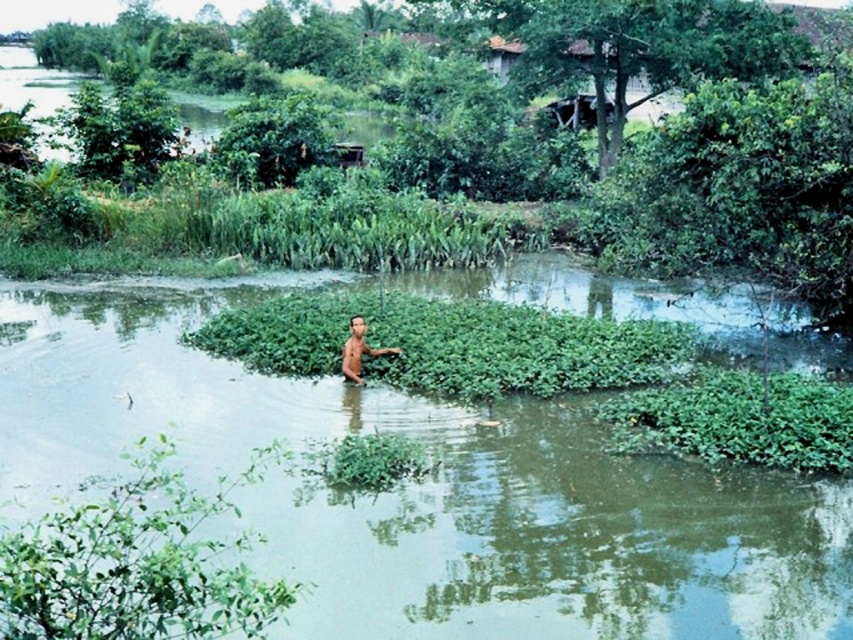
Does green leafy plant at lower left appear on the right side of brown skin man at center?

No, green leafy plant at lower left is not to the right of brown skin man at center.

Which is behind, point (231, 566) or point (364, 353)?

Point (364, 353)

What do you see at coordinates (138, 563) in the screenshot? The image size is (853, 640). I see `green leafy plant at lower left` at bounding box center [138, 563].

You are a GUI agent. You are given a task and a screenshot of the screen. Output one action in this format:
    pyautogui.click(x=<x>, y=<y>)
    Task: Click on the green leafy plant at lower left
    
    Given the screenshot: What is the action you would take?
    pyautogui.click(x=138, y=563)

Who is lower down, green leafy vegetation at center or brown skin man at center?

brown skin man at center is below.

Does green leafy vegetation at center have a larger size compared to brown skin man at center?

Correct, green leafy vegetation at center is larger in size than brown skin man at center.

Does point (38, 48) lie in front of point (347, 371)?

No, (38, 48) is further to viewer.

Where is `green leafy vegetation at center`? The height and width of the screenshot is (640, 853). green leafy vegetation at center is located at coordinates (212, 40).

Who is positioned more to the right, green leafy vegetation at center or green leafy plant at lower left?

Positioned to the right is green leafy plant at lower left.

Between green leafy vegetation at center and green leafy plant at lower left, which one is positioned lower?

Positioned lower is green leafy plant at lower left.

Does point (410, 10) come farther from viewer compared to point (242, 548)?

Yes, it is behind point (242, 548).

Where is `green leafy vegetation at center`? Image resolution: width=853 pixels, height=640 pixels. green leafy vegetation at center is located at coordinates (212, 40).